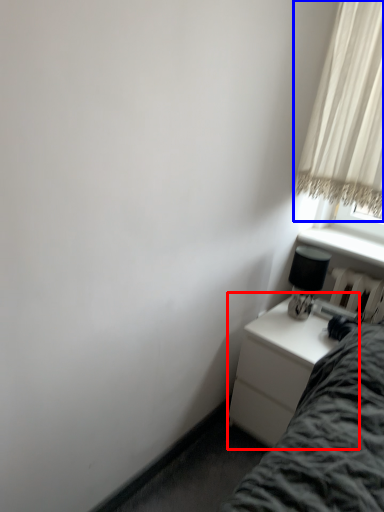
Question: Which point is closer to the camera, nightstand (highlighted by a red box) or curtain (highlighted by a blue box)?

Choices:
 (A) nightstand
 (B) curtain

Answer: (B)